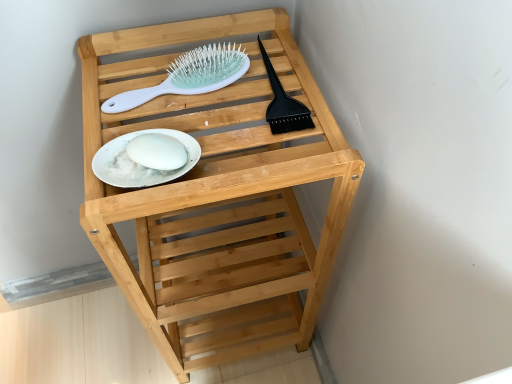
What do you see at coordinates (138, 163) in the screenshot? I see `white glossy plate at center` at bounding box center [138, 163].

Describe the element at coordinates (189, 76) in the screenshot. I see `white plastic hairbrush at upper center` at that location.

The image size is (512, 384). Identify the location of natural wood shelf at center. (218, 198).

In the image, is white plastic hairbrush at upper center on the left side or the right side of white glossy plate at center?

white plastic hairbrush at upper center is to the right of white glossy plate at center.

Is white plastic hairbrush at upper center turned away from white glossy plate at center?

No, white glossy plate at center is not at the back of white plastic hairbrush at upper center.

In terms of height, does white plastic hairbrush at upper center look taller or shorter compared to white glossy plate at center?

Clearly, white plastic hairbrush at upper center is taller compared to white glossy plate at center.

Can you confirm if white plastic hairbrush at upper center is wider than white glossy plate at center?

Indeed, white plastic hairbrush at upper center has a greater width compared to white glossy plate at center.

From the image's perspective, is natural wood shelf at center above white plastic hairbrush at upper center?

No.

Considering the relative sizes of natural wood shelf at center and white plastic hairbrush at upper center in the image provided, is natural wood shelf at center taller than white plastic hairbrush at upper center?

Indeed, natural wood shelf at center has a greater height compared to white plastic hairbrush at upper center.

Based on their sizes in the image, would you say natural wood shelf at center is bigger or smaller than white plastic hairbrush at upper center?

Considering their sizes, natural wood shelf at center takes up more space than white plastic hairbrush at upper center.

Consider the image. From a real-world perspective, is natural wood shelf at center over white plastic hairbrush at upper center?

No, from a real-world perspective, natural wood shelf at center is not above white plastic hairbrush at upper center.

Is white glossy plate at center wider than natural wood shelf at center?

No.

The height and width of the screenshot is (384, 512). In order to click on furniture that appears below the white glossy plate at center (from a real-world perspective) in this screenshot , I will do `click(218, 198)`.

Does white glossy plate at center have a greater height compared to natural wood shelf at center?

No, white glossy plate at center is not taller than natural wood shelf at center.

Is white glossy plate at center facing towards natural wood shelf at center?

Yes.

Can you confirm if natural wood shelf at center is smaller than white glossy plate at center?

No, natural wood shelf at center is not smaller than white glossy plate at center.

Is natural wood shelf at center not near white glossy plate at center?

They are positioned close to each other.

From the image's perspective, is natural wood shelf at center located above or below white glossy plate at center?

From the image's perspective, natural wood shelf at center appears below white glossy plate at center.

Does white plastic hairbrush at upper center have a greater height compared to natural wood shelf at center?

No.

In the scene shown: From the image's perspective, is white plastic hairbrush at upper center located beneath natural wood shelf at center?

No.

Can you tell me how much white plastic hairbrush at upper center and natural wood shelf at center differ in facing direction?

The facing directions of white plastic hairbrush at upper center and natural wood shelf at center are 5.11 degrees apart.

Considering the relative positions of white plastic hairbrush at upper center and natural wood shelf at center in the image provided, is white plastic hairbrush at upper center behind natural wood shelf at center?

Yes, the depth of white plastic hairbrush at upper center is greater than that of natural wood shelf at center.

Would you say white glossy plate at center is to the left or to the right of white plastic hairbrush at upper center in the picture?

white glossy plate at center is positioned on white plastic hairbrush at upper center's left side.

Can you confirm if white glossy plate at center is wider than white plastic hairbrush at upper center?

In fact, white glossy plate at center might be narrower than white plastic hairbrush at upper center.

In the image, is white glossy plate at center positioned in front of or behind white plastic hairbrush at upper center?

Visually, white glossy plate at center is located in front of white plastic hairbrush at upper center.

In terms of height, does white glossy plate at center look taller or shorter compared to white plastic hairbrush at upper center?

In the image, white glossy plate at center appears to be shorter than white plastic hairbrush at upper center.

Locate an element on the screen. The height and width of the screenshot is (384, 512). brush to the right of white glossy plate at center is located at coordinates (189, 76).

At what (x,y) coordinates should I click in order to perform the action: click on furniture that is below the white plastic hairbrush at upper center (from the image's perspective). Please return your answer as a coordinate pair (x, y). Looking at the image, I should click on (218, 198).

When comparing their distances from white plastic hairbrush at upper center, does natural wood shelf at center or white glossy plate at center seem further?

Among the two, natural wood shelf at center is located further to white plastic hairbrush at upper center.

Which object lies nearer to the anchor point natural wood shelf at center, white glossy plate at center or white plastic hairbrush at upper center?

white plastic hairbrush at upper center lies closer to natural wood shelf at center than the other object.

Considering their positions, is white plastic hairbrush at upper center positioned further to natural wood shelf at center than white glossy plate at center?

white glossy plate at center.

From the image, which object appears to be farther from white glossy plate at center, natural wood shelf at center or white plastic hairbrush at upper center?

Based on the image, natural wood shelf at center appears to be further to white glossy plate at center.

Considering their positions, is white glossy plate at center positioned closer to white plastic hairbrush at upper center than natural wood shelf at center?

white glossy plate at center is closer to white plastic hairbrush at upper center.

Based on their spatial positions, is white plastic hairbrush at upper center or natural wood shelf at center closer to white glossy plate at center?

white plastic hairbrush at upper center is positioned closer to the anchor white glossy plate at center.

Where is `plate between white plastic hairbrush at upper center and natural wood shelf at center in the vertical direction`? plate between white plastic hairbrush at upper center and natural wood shelf at center in the vertical direction is located at coordinates (138, 163).